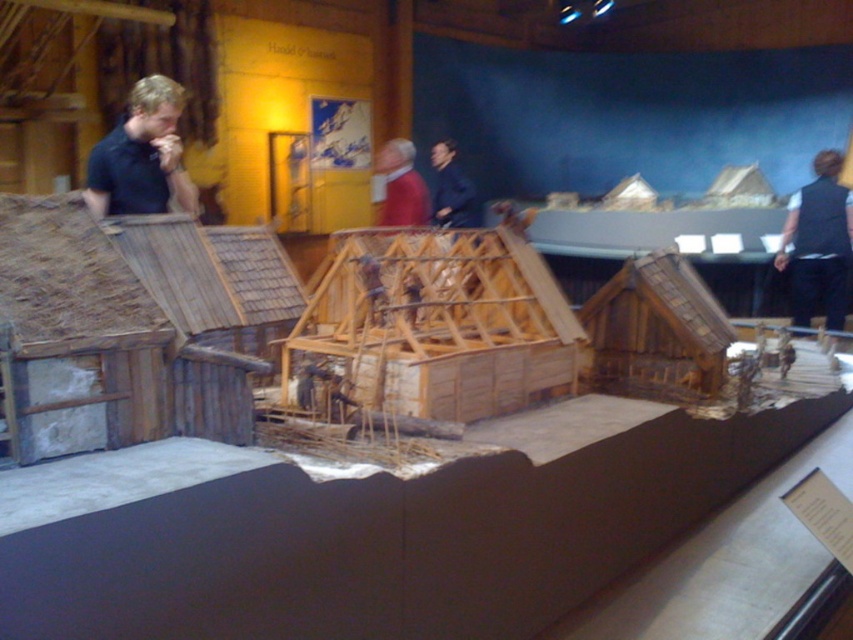
Question: Does wooden frame hut at center have a larger size compared to black vest at right?

Choices:
 (A) no
 (B) yes

Answer: (B)

Question: Can you confirm if red sweater at center is positioned above dark blue jacket at center?

Choices:
 (A) no
 (B) yes

Answer: (A)

Question: Estimate the real-world distances between objects in this image. Which object is closer to the dark blue jacket at center?

Choices:
 (A) red sweater at center
 (B) wooden frame hut at center
 (C) matte black shirt at left
 (D) thatched wood hut at left

Answer: (A)

Question: Which object is positioned closest to the dark blue jacket at center?

Choices:
 (A) wooden frame hut at center
 (B) thatched wood hut at left
 (C) matte black shirt at left

Answer: (C)

Question: Can you confirm if red sweater at center is smaller than dark blue jacket at center?

Choices:
 (A) no
 (B) yes

Answer: (B)

Question: Estimate the real-world distances between objects in this image. Which object is closer to the matte black shirt at left?

Choices:
 (A) thatched wood hut at left
 (B) wooden frame hut at center

Answer: (A)